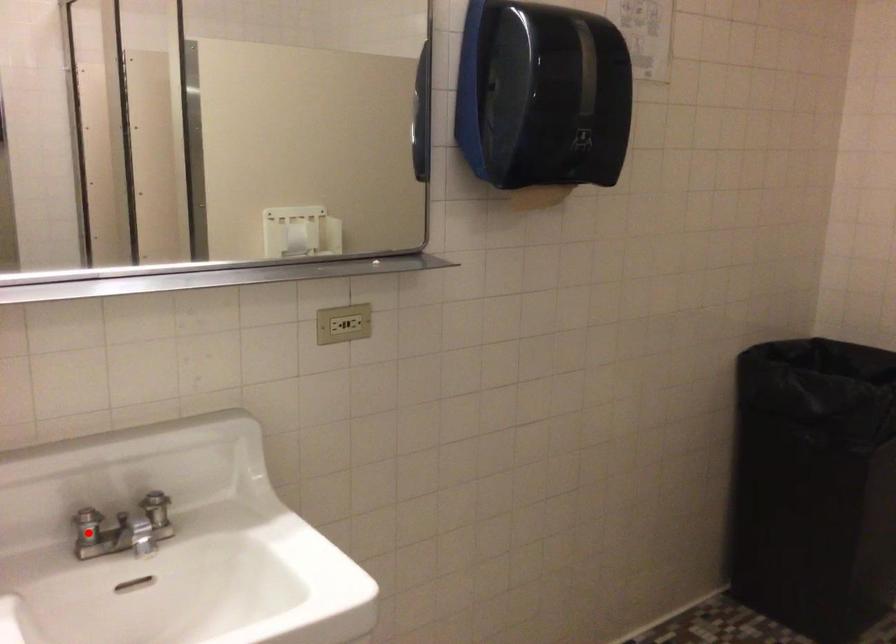
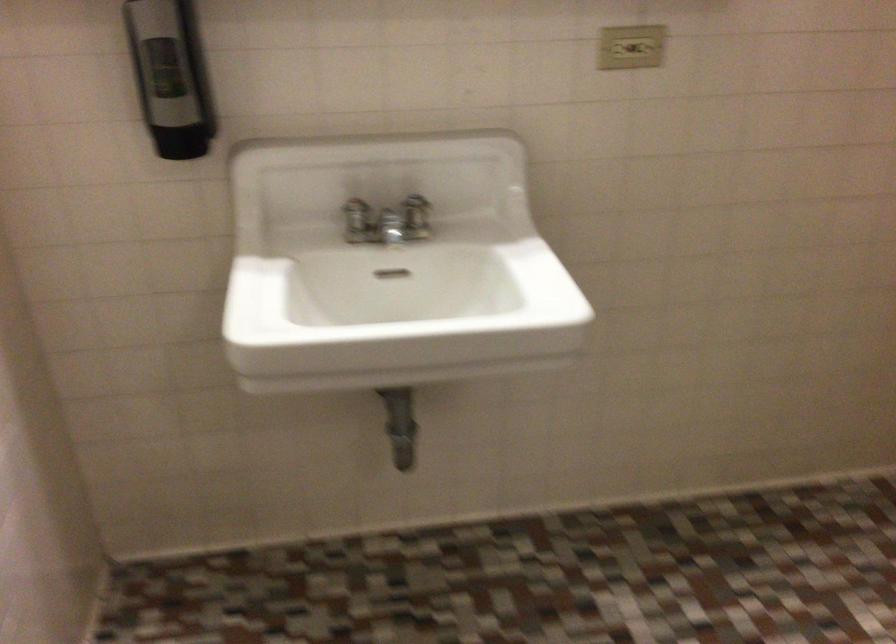
Locate, in the second image, the point that corresponds to the highlighted location in the first image.

(357, 221)